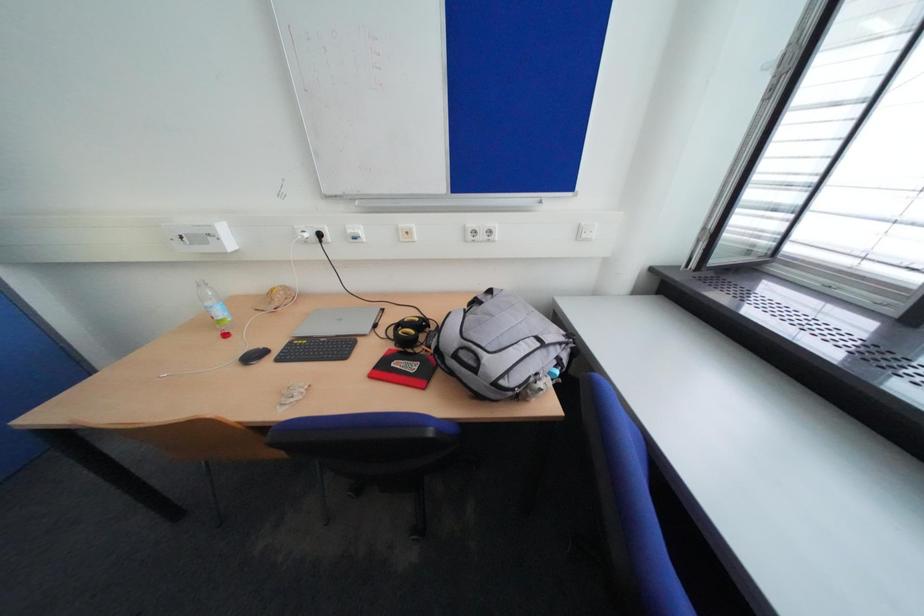
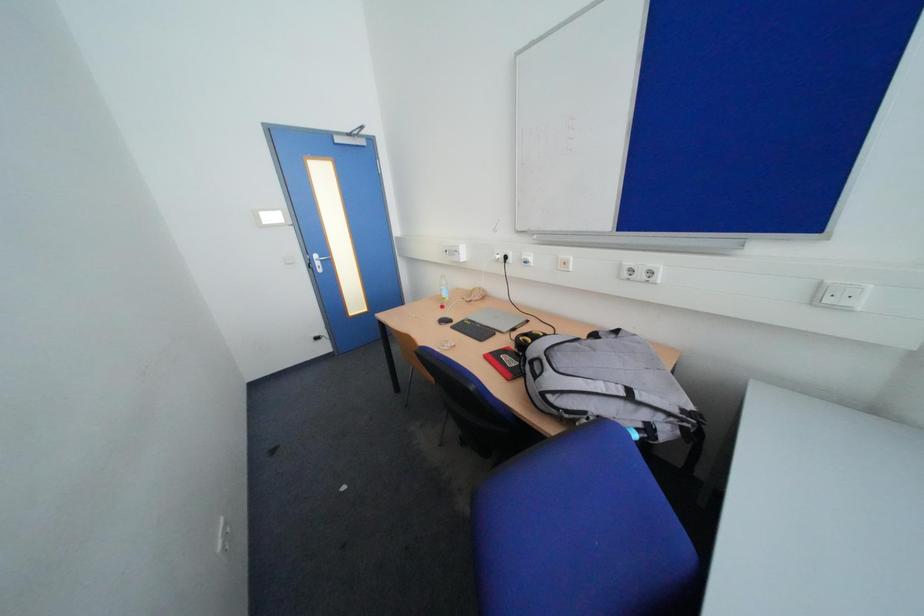
Question: The camera is either moving clockwise (left) or counter-clockwise (right) around the object. The first image is from the beginning of the video and the second image is from the end. Is the camera moving left or right when shooting the video?

Choices:
 (A) Left
 (B) Right

Answer: (B)